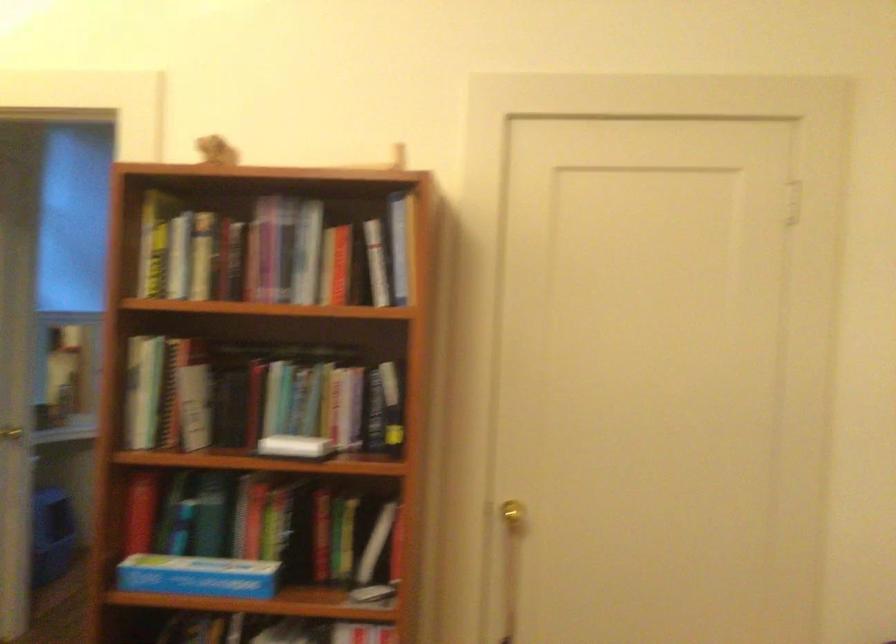
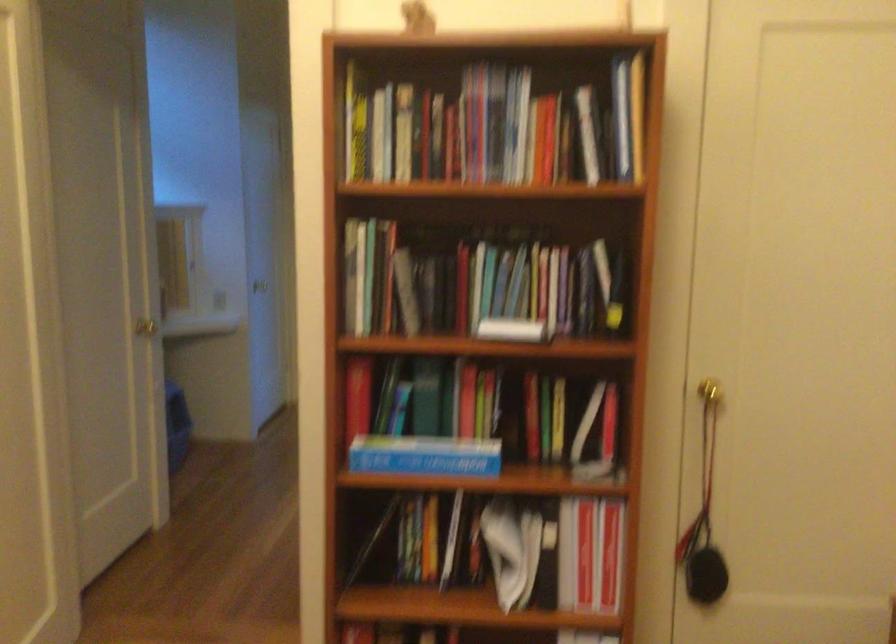
Where in the second image is the point corresponding to point 11,433 from the first image?

(164, 334)